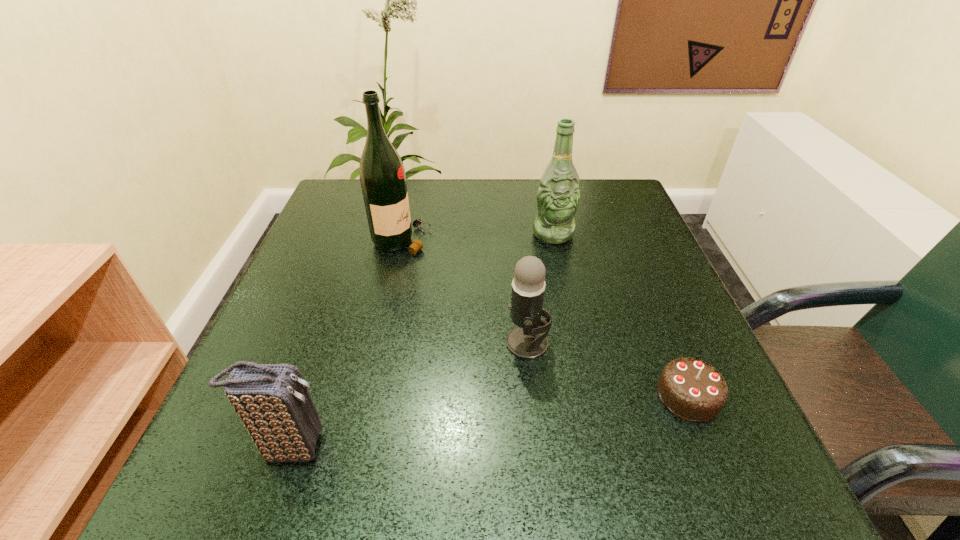
Where is `the tallest object`? This screenshot has height=540, width=960. the tallest object is located at coordinates (382, 175).

What are the coordinates of `the second tallest object` in the screenshot? It's located at (558, 196).

This screenshot has width=960, height=540. I want to click on the second object from right to left, so click(558, 196).

The width and height of the screenshot is (960, 540). In order to click on the third object from right to left in this screenshot , I will do click(x=528, y=341).

Where is `microphone`? microphone is located at coordinates coord(528,341).

You are a GUI agent. You are given a task and a screenshot of the screen. Output one action in this format:
    pyautogui.click(x=<x>, y=<y>)
    Task: Click on the nearest object
    The image size is (960, 540).
    Given the screenshot: What is the action you would take?
    pyautogui.click(x=273, y=402)

Find the location of `the shortest object`. the shortest object is located at coordinates (692, 389).

The width and height of the screenshot is (960, 540). Identify the location of chocolate cake. (692, 389).

At what (x,y) coordinates should I click in order to perform the action: click on vacant position located 0.390m on the surface of the wine bottle. Please return your answer as a coordinate pair (x, y). The height and width of the screenshot is (540, 960). Looking at the image, I should click on (603, 240).

The image size is (960, 540). Find the location of `vacant point located on the surface of the fourth object from left to right`. vacant point located on the surface of the fourth object from left to right is located at coordinates (580, 357).